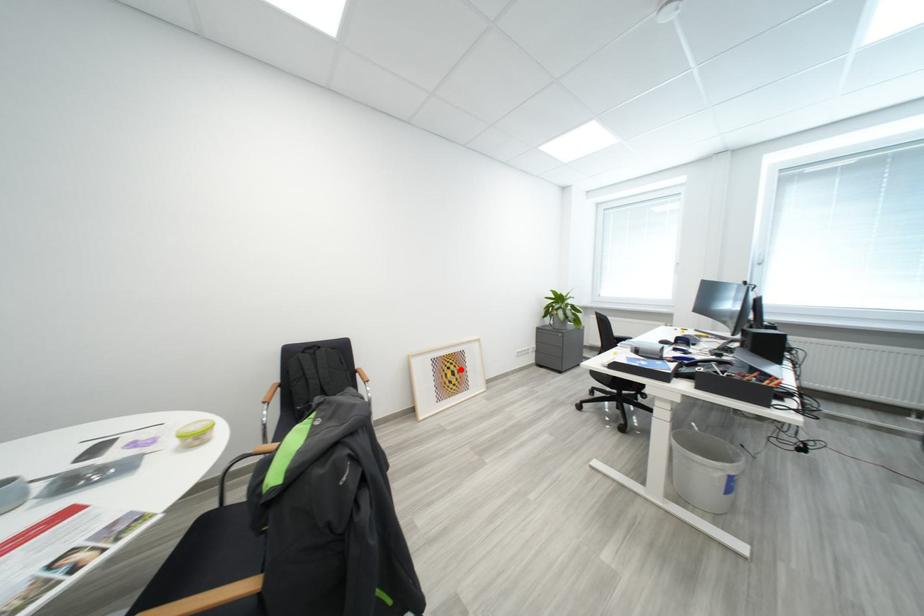
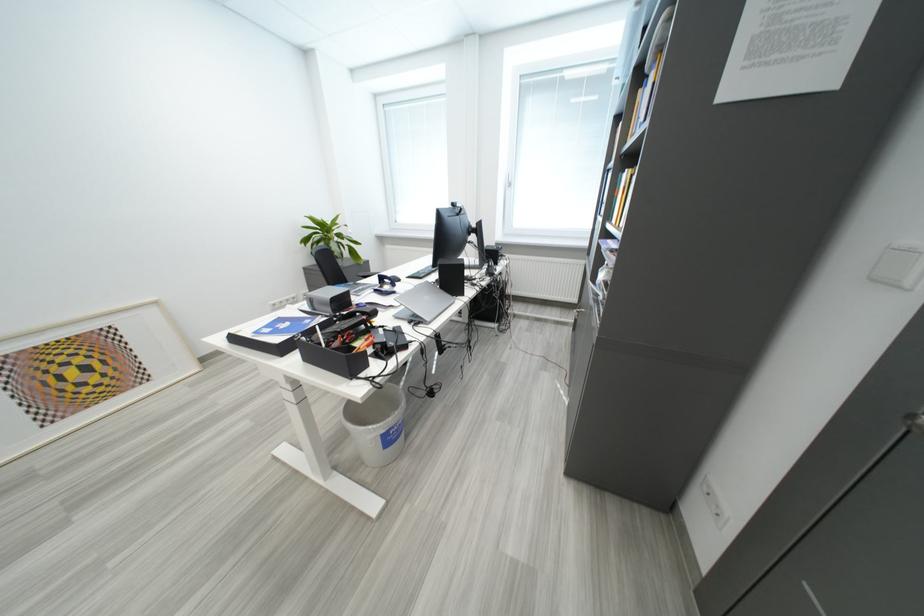
Where in the second image is the point corresponding to the highlighted location from the first image?

(88, 363)